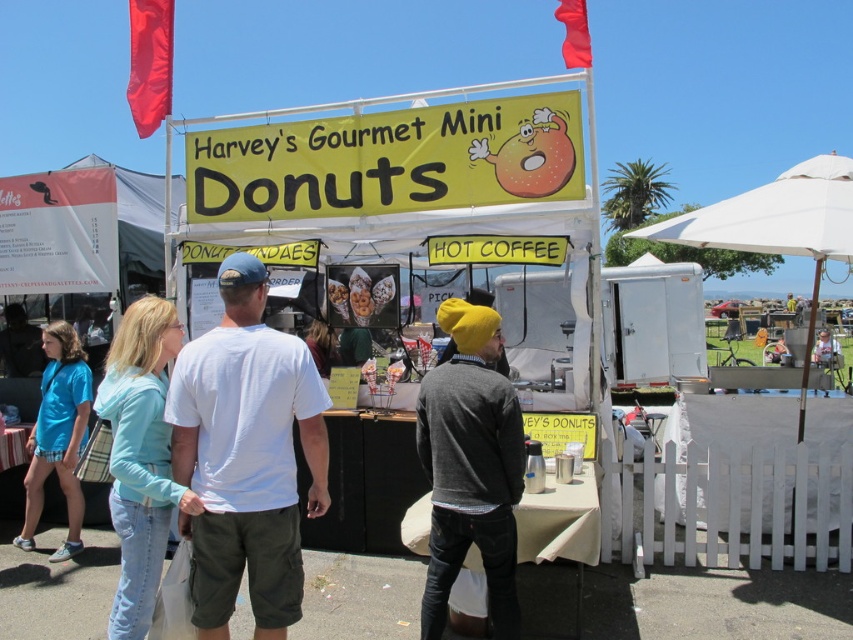
You are standing at the donut stand and want to know which of the two points, point (254, 376) or point (50, 451), is closer to you. Can you determine this based on the scene?

Point (254, 376) is closer to the viewer than point (50, 451).